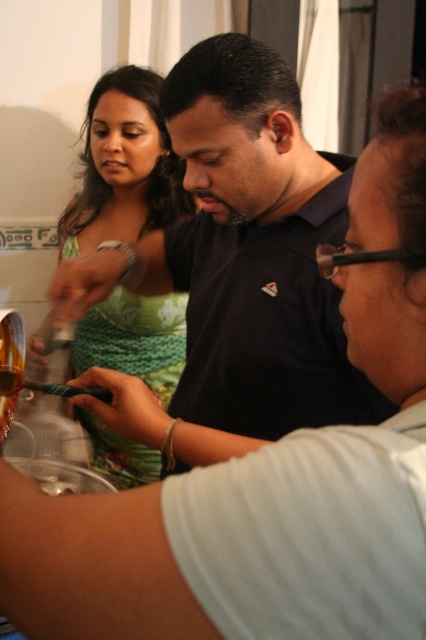
Question: Does dark blue shirt at center appear over green textured dress at upper left?

Choices:
 (A) no
 (B) yes

Answer: (A)

Question: Can you confirm if dark blue shirt at center is positioned to the left of green textured dress at upper left?

Choices:
 (A) yes
 (B) no

Answer: (B)

Question: Which point appears closest to the camera in this image?

Choices:
 (A) (275, 196)
 (B) (157, 204)

Answer: (A)

Question: Is dark blue shirt at center positioned before green textured dress at upper left?

Choices:
 (A) yes
 (B) no

Answer: (A)

Question: Which object appears closest to the camera in this image?

Choices:
 (A) dark blue shirt at center
 (B) green textured dress at upper left

Answer: (A)

Question: Which of the following is the closest to the observer?

Choices:
 (A) (126, 429)
 (B) (144, 218)

Answer: (A)